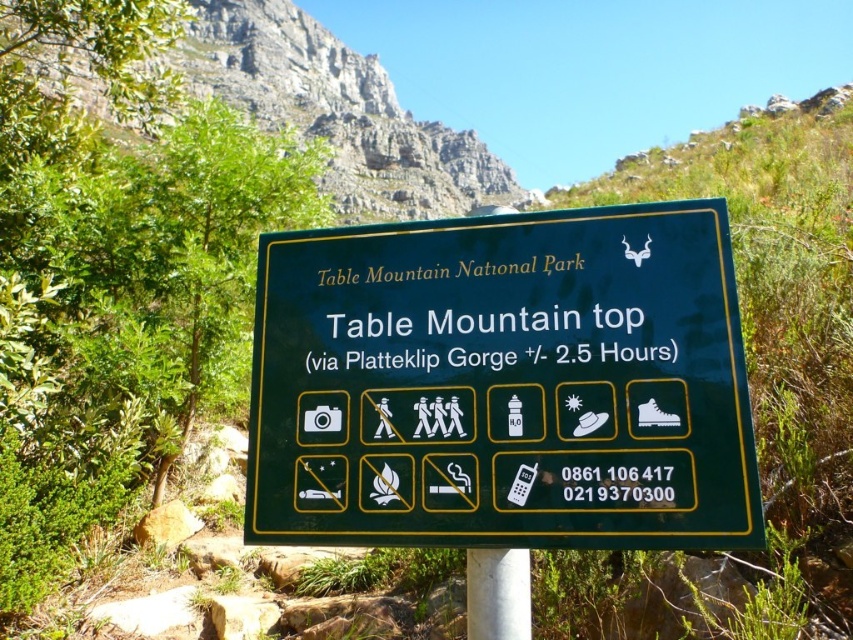
You are standing in front of the signboard at Table Mountain National Park. There are two points marked on the signboard. The first point is at coordinates point (x=606, y=468) and the second is at point (x=511, y=604). If you were to touch both points with your finger, which point would you reach first?

Point (x=606, y=468) is closer to the viewer than point (x=511, y=604), so you would reach it first.

You are planning to hike up Table Mountain and see the green matte sign at center attached to the white smooth pole at center. Is the sign positioned higher or lower than the pole?

The green matte sign at center is above the white smooth pole at center, so the sign is positioned higher than the pole.

You are at Table Mountain National Park and see the green matte sign at center and the white smooth pole at center. From the perspective of someone facing the sign, which object is on the right?

The white smooth pole at center is on the right side of the green matte sign at center.